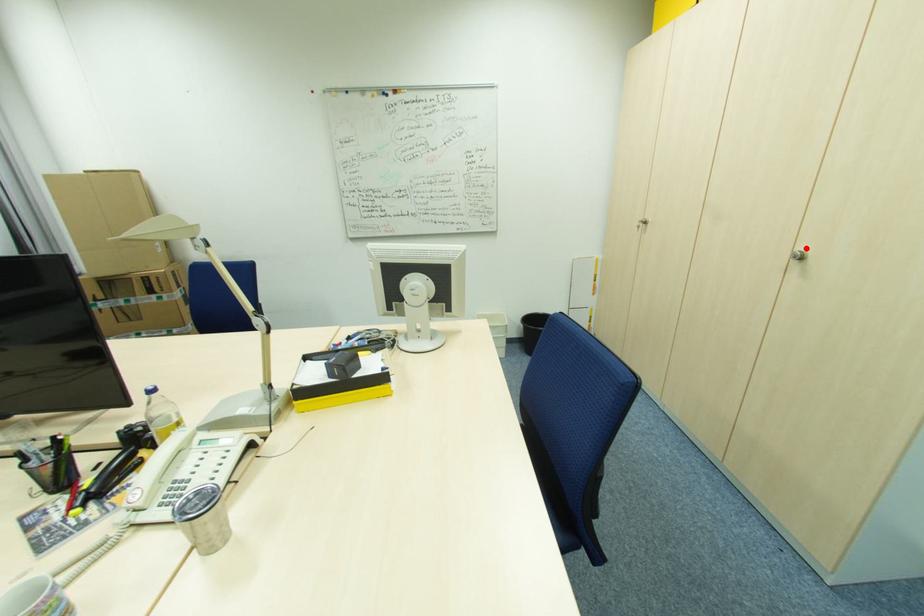
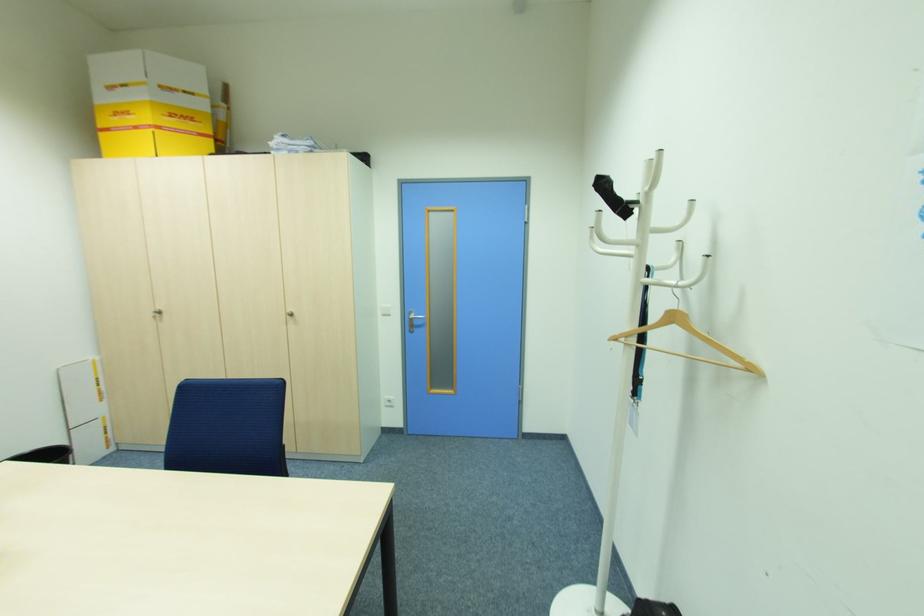
Locate, in the second image, the point that corresponds to the highlighted location in the first image.

(292, 310)